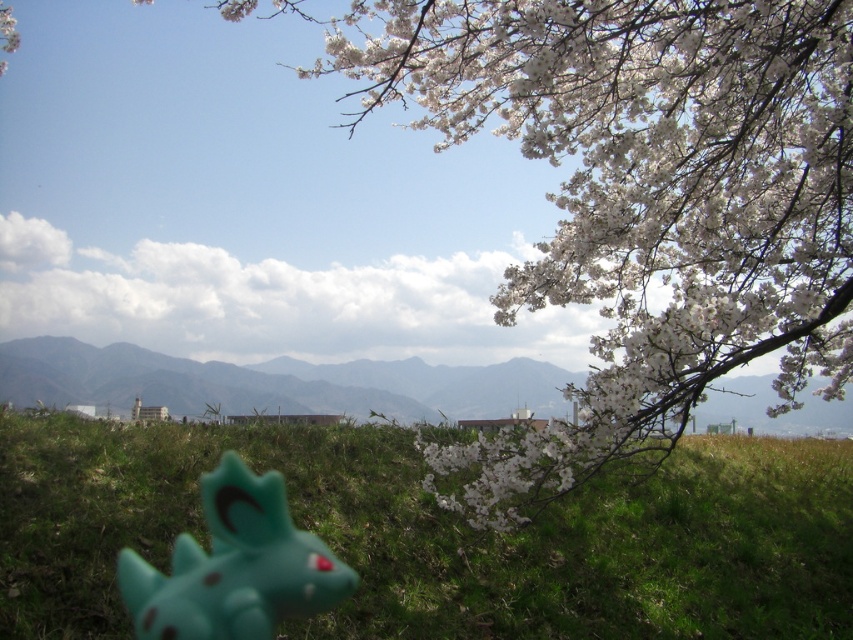
Based on the photo, you are standing in the outdoor scene and want to walk from point A to point B. Point A is at coordinate point point (379, 545) and point B is at coordinate point (209, 634). Which point is closer to you when you start walking?

Point (379, 545) is further to the viewer than point (209, 634), so when you start walking, point B at (209, 634) is closer to you.

You are a child playing in the outdoor scene. You want to place your teal rubber toy at lower left on top of the green grassy at lower center. Is this possible?

The green grassy at lower center is positioned over teal rubber toy at lower left, so yes, you can place the teal rubber toy at lower left on top of the green grassy at lower center since it is already underneath it.

You are standing at the point marked as point (x=132, y=348) and want to walk directly towards the cherry blossom tree branch in the midground. Is there enough space between the small green toy dinosaur in the lower left corner and the tree branch to walk through?

The distance between the point marked as point (x=132, y=348) and the cherry blossom tree branch in the midground is 10.34 meters, so there is sufficient space to walk through between them.